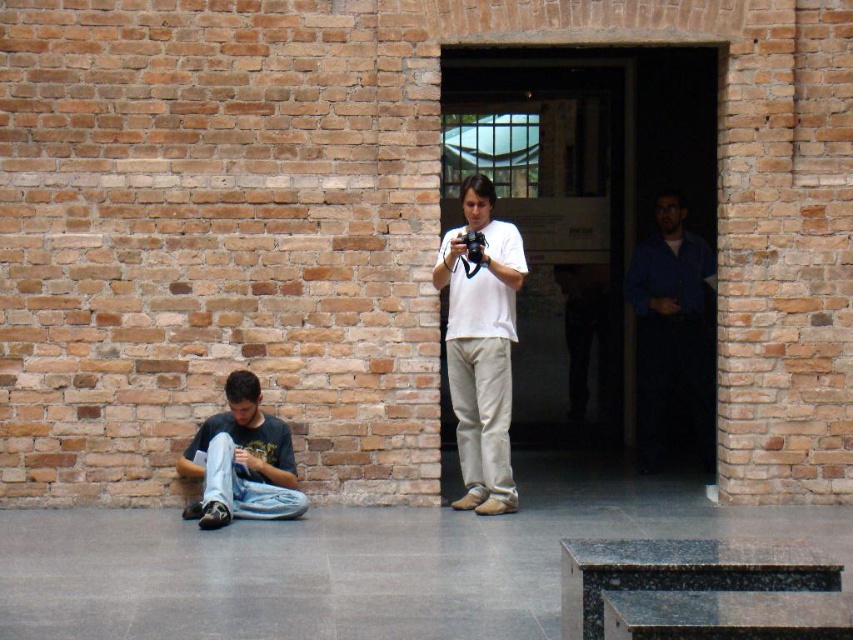
You are standing in the room and want to hand a note to the person wearing the dark blue shirt at right. Based on their position relative to the doorway, can you approach them directly from the doorway without needing to go around any obstacles?

The dark blue shirt at right is located at point (672,333), which is near the doorway. Since they are positioned near the doorway, you can approach them directly from the doorway without needing to go around any obstacles.

You are a delivery person carrying a box that requires a minimum of 3 meters of space to maneuver safely. You need to move from the doorway to the brick wall. Is there enough space between the dark blue shirt at right and denim jeans at lower left to navigate safely?

The distance between the dark blue shirt at right and denim jeans at lower left is 3.75 meters, which is more than the required 3 meters. Therefore, there is sufficient space to maneuver safely.